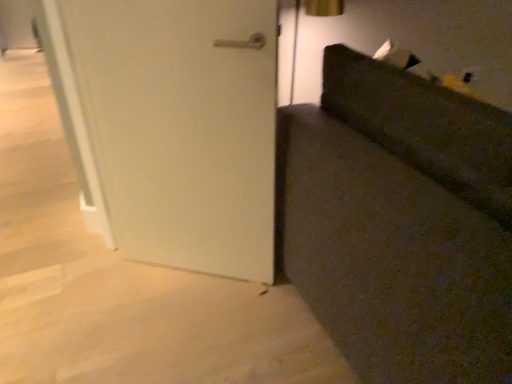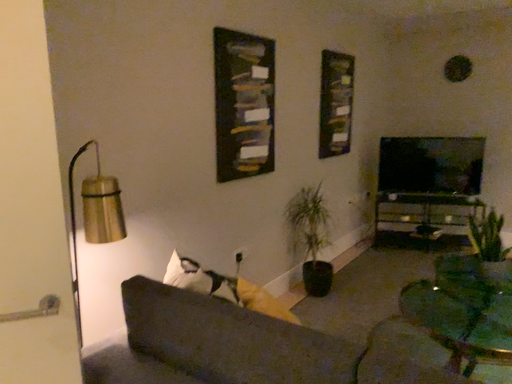
Question: Which way did the camera rotate in the video?

Choices:
 (A) rotated upward
 (B) rotated downward

Answer: (A)